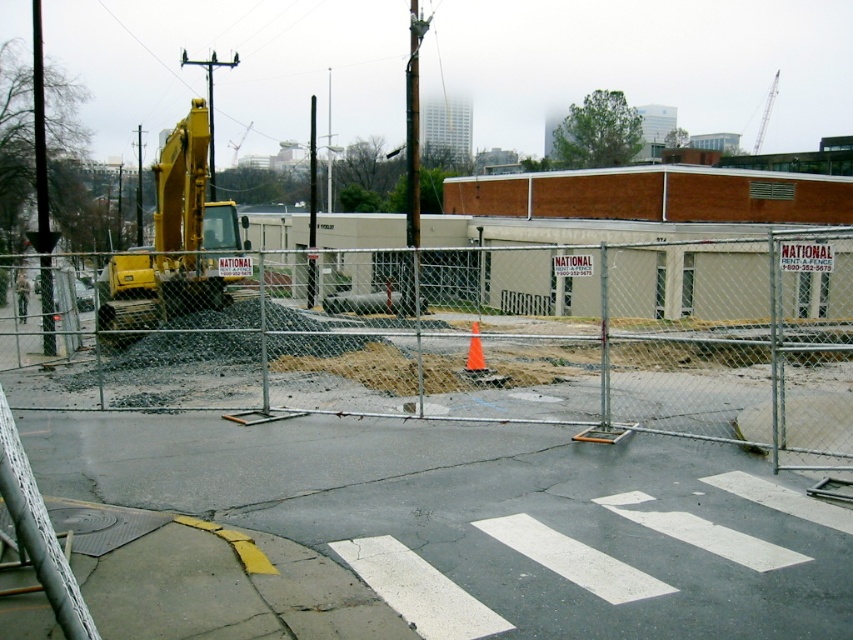
Question: Is orange matte traffic cone at center bigger than green camouflage uniform at center?

Choices:
 (A) no
 (B) yes

Answer: (A)

Question: Among these objects, which one is nearest to the camera?

Choices:
 (A) orange matte traffic cone at center
 (B) silver chain-link fence at center

Answer: (B)

Question: Can you confirm if silver chain-link fence at center is bigger than green camouflage uniform at center?

Choices:
 (A) no
 (B) yes

Answer: (B)

Question: Among these points, which one is nearest to the camera?

Choices:
 (A) (485, 369)
 (B) (120, 317)
 (C) (569, 284)
 (D) (16, 289)

Answer: (A)

Question: Which of the following is the closest to the observer?

Choices:
 (A) (16, 288)
 (B) (480, 364)
 (C) (144, 289)
 (D) (805, 364)

Answer: (B)

Question: Is orange matte traffic cone at center bigger than green camouflage uniform at center?

Choices:
 (A) yes
 (B) no

Answer: (B)